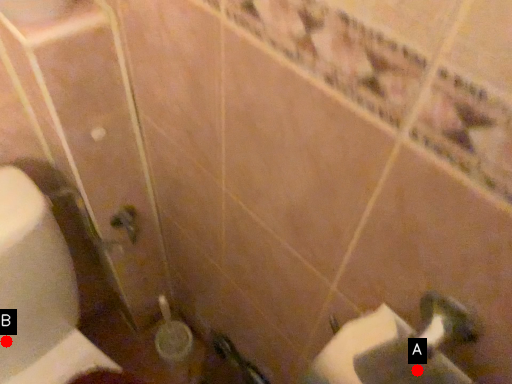
Question: Two points are circled on the image, labeled by A and B beside each circle. Which of the following is the farthest from the observer?

Choices:
 (A) A is further
 (B) B is further

Answer: (B)